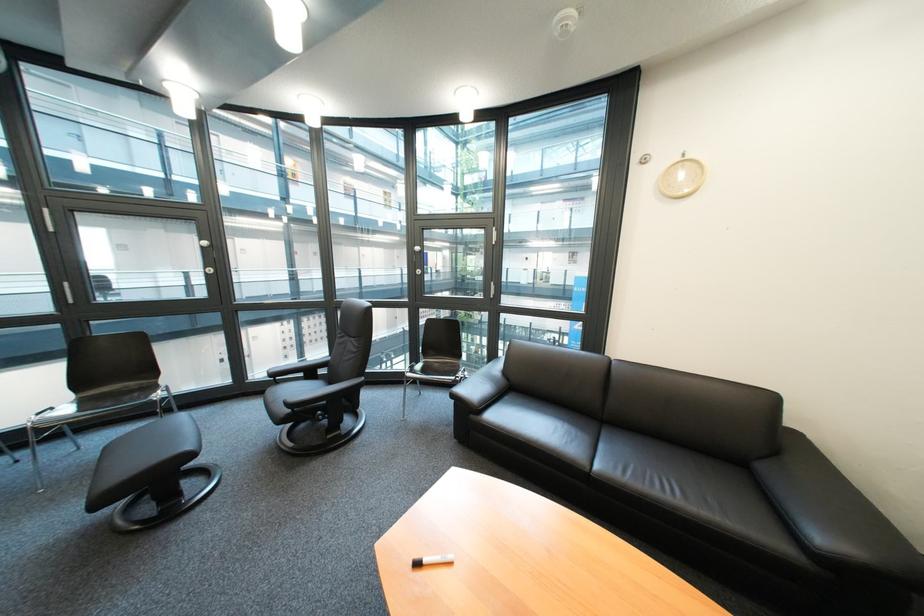
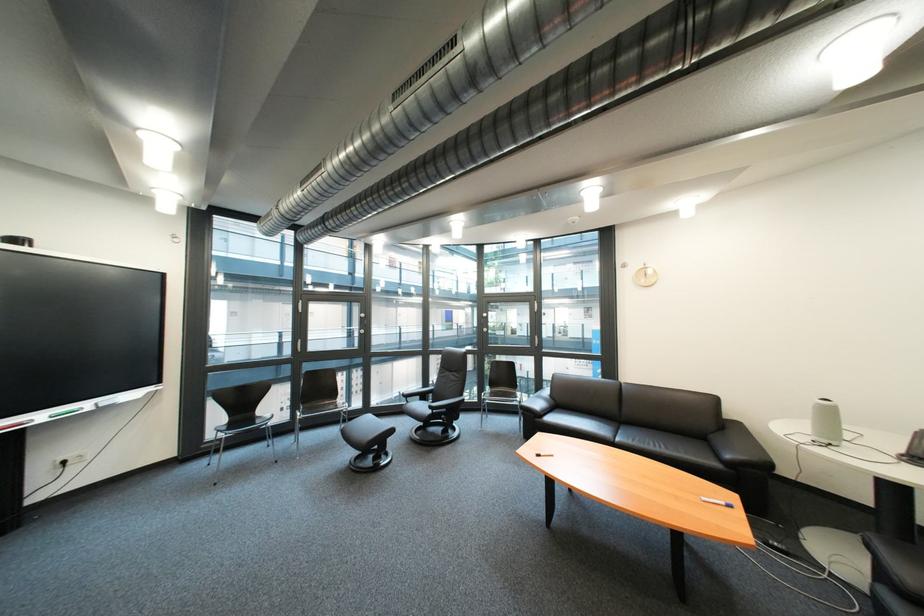
Where in the second image is the point corresponding to point 833,540 from the first image?

(742, 458)